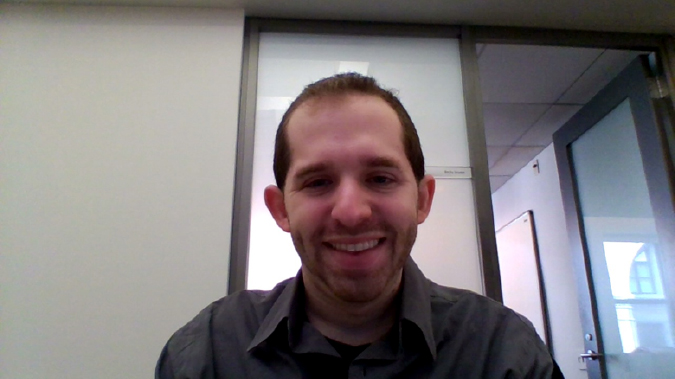
The width and height of the screenshot is (675, 379). I want to click on white board, so click(528, 272).